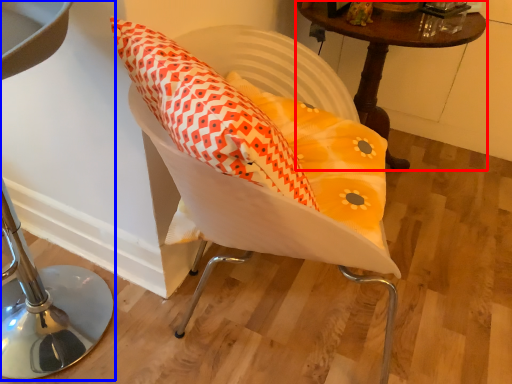
Question: Which point is further to the camera, table (highlighted by a red box) or furniture (highlighted by a blue box)?

Choices:
 (A) table
 (B) furniture

Answer: (A)